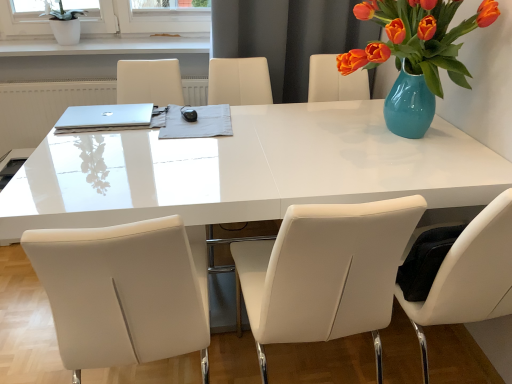
At what (x,y) coordinates should I click in order to perform the action: click on vacant area that is in front of gray fabric at center. Please return your answer as a coordinate pair (x, y). Looking at the image, I should click on (182, 153).